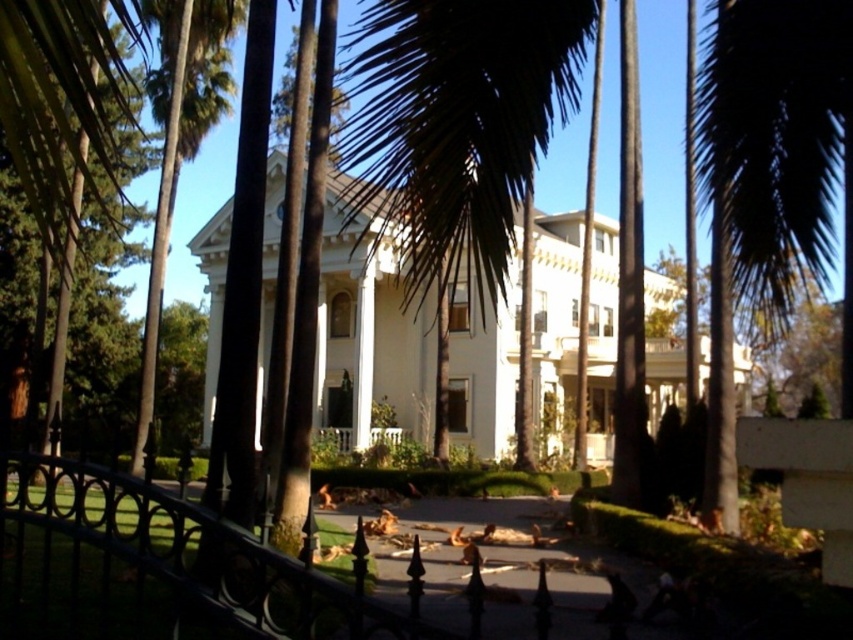
The width and height of the screenshot is (853, 640). I want to click on green leafy palm tree at center, so click(779, 148).

Is green leafy palm tree at center smaller than green leafy palm tree at left?

Yes.

Is point (756, 90) in front of point (183, 33)?

Yes, it is.

Locate an element on the screen. The image size is (853, 640). green leafy palm tree at center is located at coordinates (779, 148).

Between dark green leafy palm tree at center and green leafy palm tree at left, which one appears on the right side from the viewer's perspective?

dark green leafy palm tree at center

Is dark green leafy palm tree at center bigger than green leafy palm tree at left?

Actually, dark green leafy palm tree at center might be smaller than green leafy palm tree at left.

Is point (572, 80) positioned before point (161, 120)?

Yes, it is in front of point (161, 120).

Where is `dark green leafy palm tree at center`? The height and width of the screenshot is (640, 853). dark green leafy palm tree at center is located at coordinates (457, 125).

Is white glossy mansion at center shorter than dark green leafy palm tree at center?

No, white glossy mansion at center is not shorter than dark green leafy palm tree at center.

Who is positioned more to the left, white glossy mansion at center or dark green leafy palm tree at center?

From the viewer's perspective, dark green leafy palm tree at center appears more on the left side.

Describe the element at coordinates (368, 339) in the screenshot. Image resolution: width=853 pixels, height=640 pixels. I see `white glossy mansion at center` at that location.

The height and width of the screenshot is (640, 853). In order to click on white glossy mansion at center in this screenshot , I will do `click(368, 339)`.